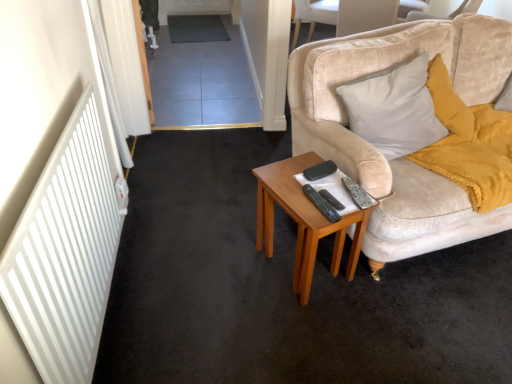
You are a GUI agent. You are given a task and a screenshot of the screen. Output one action in this format:
    pyautogui.click(x=<x>, y=<y>)
    Task: Click on the free space behind black plastic remote control at center, which ranks as the 2th remote control in left-to-right order
    
    Given the screenshot: What is the action you would take?
    pyautogui.click(x=321, y=186)